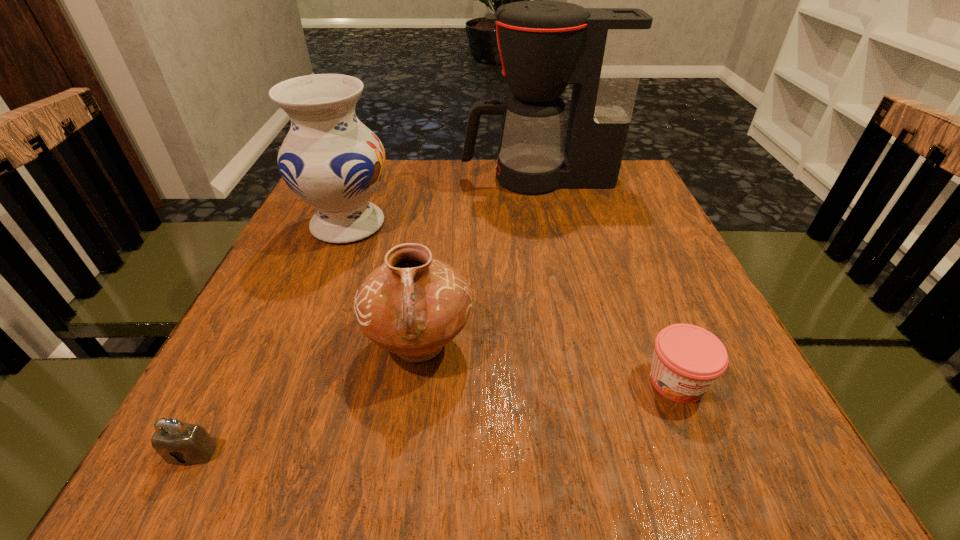
Locate an element on the screen. the farthest object is located at coordinates (544, 45).

This screenshot has width=960, height=540. Identify the location of coffee maker. (544, 45).

The height and width of the screenshot is (540, 960). Identify the location of the fourth nearest object. (333, 162).

Where is `the second tallest object`? the second tallest object is located at coordinates (333, 162).

The height and width of the screenshot is (540, 960). What are the coordinates of `pottery` in the screenshot? It's located at (412, 305).

You are a GUI agent. You are given a task and a screenshot of the screen. Output one action in this format:
    pyautogui.click(x=<x>, y=<y>)
    Task: Click on the jam
    
    Given the screenshot: What is the action you would take?
    pyautogui.click(x=687, y=360)

Image resolution: width=960 pixels, height=540 pixels. In order to click on the nearest object in this screenshot , I will do `click(179, 443)`.

At what (x,y) coordinates should I click in order to perform the action: click on free space located 0.120m pour from the carafe of the farthest object. Please return your answer as a coordinate pair (x, y). Looking at the image, I should click on (418, 179).

Find the location of a particular element. The width and height of the screenshot is (960, 540). vacant space located 0.300m pour from the carafe of the farthest object is located at coordinates (350, 179).

Where is `blank space located 0.160m pour from the carafe of the farthest object`? The width and height of the screenshot is (960, 540). blank space located 0.160m pour from the carafe of the farthest object is located at coordinates (402, 179).